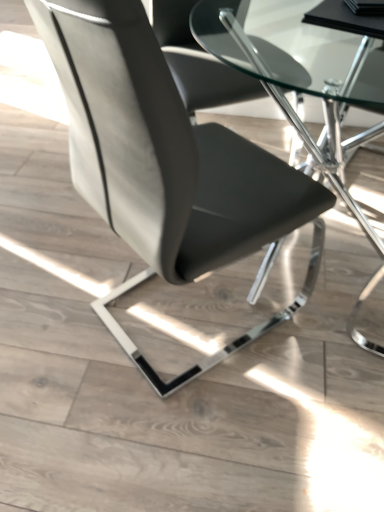
Where is `free space in front of matte black chair at center`? The height and width of the screenshot is (512, 384). free space in front of matte black chair at center is located at coordinates (199, 431).